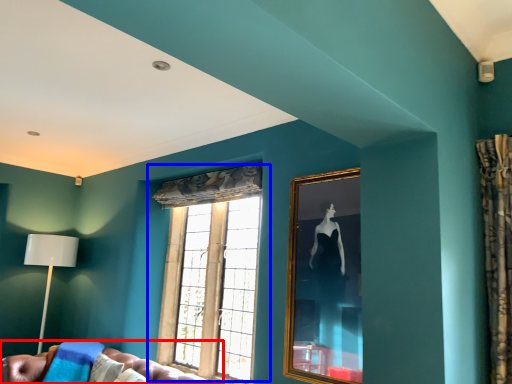
Question: Which of the following is the closest to the observer, studio couch (highlighted by a red box) or window (highlighted by a blue box)?

Choices:
 (A) studio couch
 (B) window

Answer: (A)